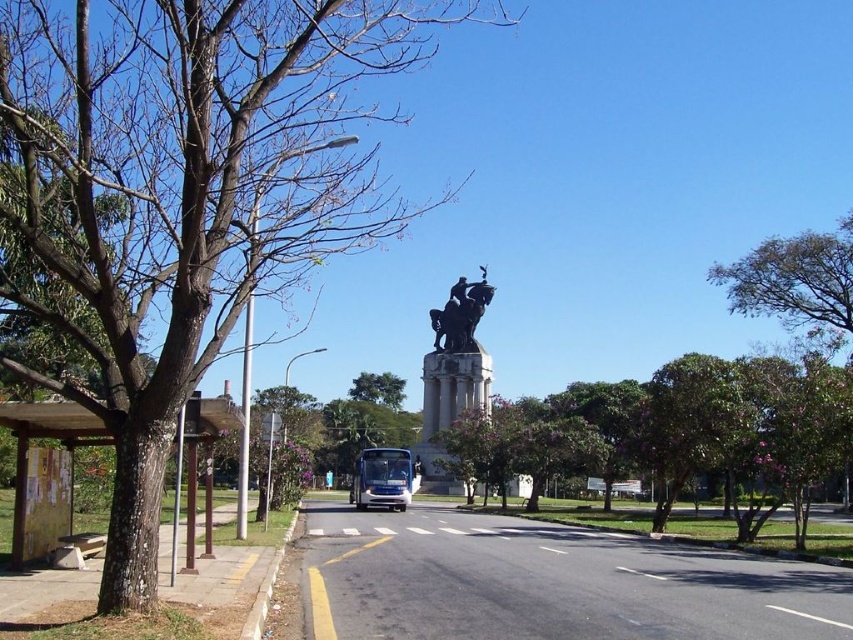
Does green leafy tree at center have a lesser height compared to shiny blue bus at center?

In fact, green leafy tree at center may be taller than shiny blue bus at center.

Is green leafy tree at center to the left of shiny blue bus at center from the viewer's perspective?

Indeed, green leafy tree at center is positioned on the left side of shiny blue bus at center.

Image resolution: width=853 pixels, height=640 pixels. Identify the location of green leafy tree at center. [378, 388].

Does point (146, 88) come in front of point (358, 381)?

Yes, it is.

Looking at this image, does brown bark tree at center appear on the left side of green leafy tree at center?

No, brown bark tree at center is not to the left of green leafy tree at center.

Between point (184, 349) and point (369, 388), which one is positioned behind?

Positioned behind is point (369, 388).

Where is `brown bark tree at center`? brown bark tree at center is located at coordinates (178, 198).

Between white glossy bus at center and green leafy tree at center, which one appears on the left side from the viewer's perspective?

green leafy tree at center

Can you confirm if white glossy bus at center is wider than green leafy tree at center?

Incorrect, white glossy bus at center's width does not surpass green leafy tree at center's.

Between point (392, 461) and point (376, 378), which one is positioned in front?

Point (392, 461) is more forward.

The width and height of the screenshot is (853, 640). In order to click on white glossy bus at center in this screenshot , I will do `click(381, 477)`.